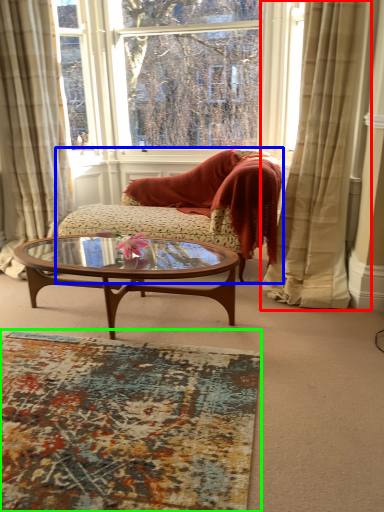
Question: Estimate the real-world distances between objects in this image. Which object is closer to curtain (highlighted by a red box), studio couch (highlighted by a blue box) or plain (highlighted by a green box)?

Choices:
 (A) studio couch
 (B) plain

Answer: (A)